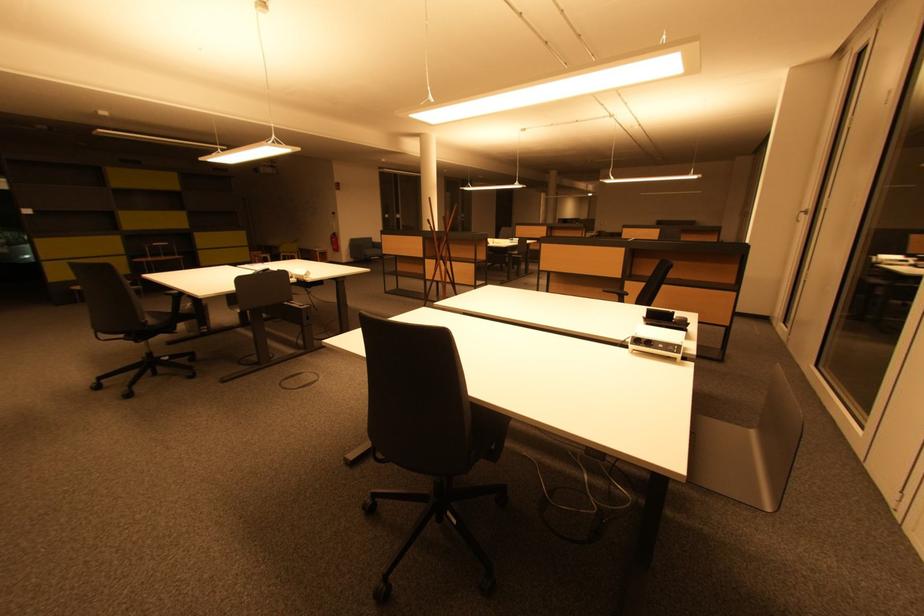
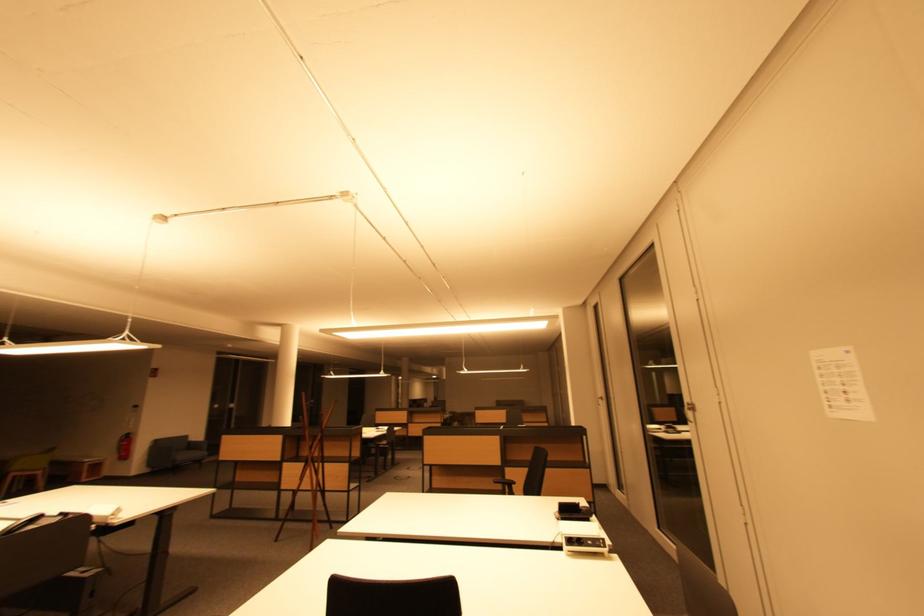
In the second image, find the point that corresponds to (x=809, y=214) in the first image.

(605, 400)